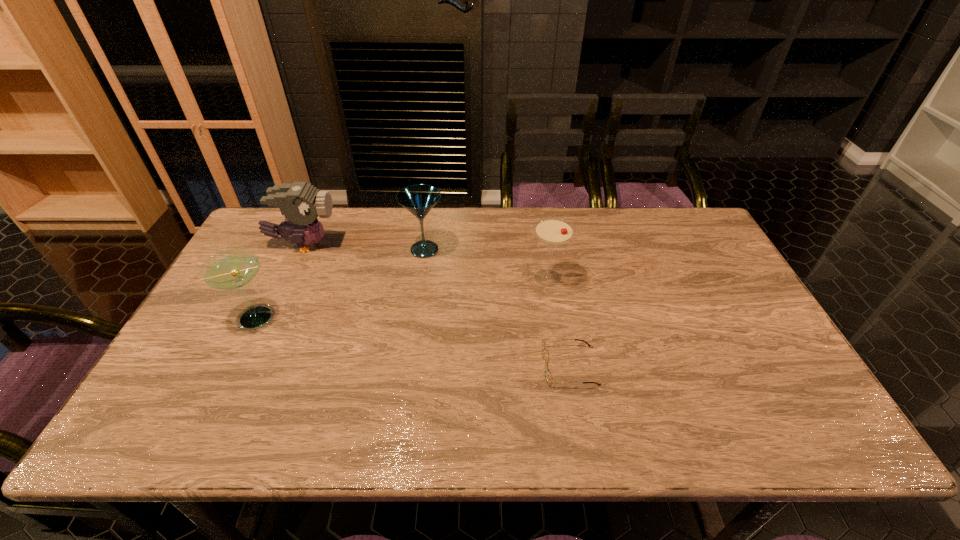
Image resolution: width=960 pixels, height=540 pixels. In order to click on free location that satisfies the following two spatial constraints: 1. at the beak of the bird; 2. on the front side of the nearest martini in this screenshot , I will do `click(271, 317)`.

Where is `free space that satisfies the following two spatial constraints: 1. at the beak of the bird; 2. on the left side of the third nearest object`? The height and width of the screenshot is (540, 960). free space that satisfies the following two spatial constraints: 1. at the beak of the bird; 2. on the left side of the third nearest object is located at coordinates (289, 278).

The width and height of the screenshot is (960, 540). Identify the location of blank space that satisfies the following two spatial constraints: 1. at the beak of the bird; 2. on the left side of the farthest martini. (301, 249).